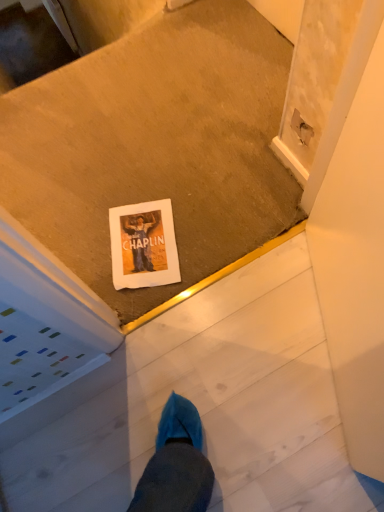
At what (x,y) coordinates should I click in order to perform the action: click on vacant space to the right of white paper at center. Please return your answer as a coordinate pair (x, y). The image size is (384, 512). Looking at the image, I should click on (206, 219).